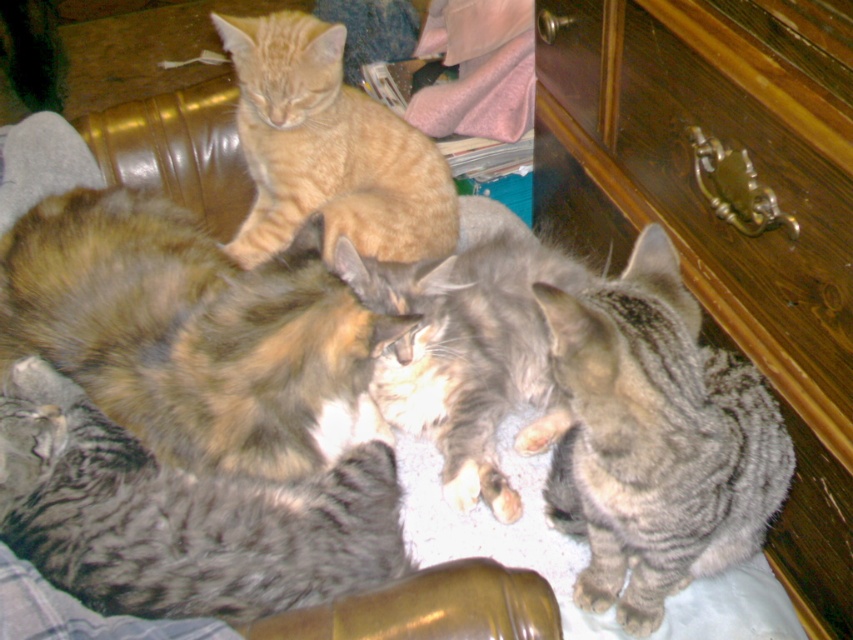
Is point (601, 381) positioned after point (445, 284)?

No, it is not.

Which of these two, gray striped cat at lower right or gray striped cat at center, stands taller?

gray striped cat at lower right is taller.

Measure the distance between point (593, 428) and camera.

Point (593, 428) and camera are 31.24 inches apart from each other.

This screenshot has width=853, height=640. I want to click on gray striped cat at lower right, so click(x=656, y=440).

Does calico fur cat at center have a greater height compared to gray striped cat at center?

Incorrect, calico fur cat at center's height is not larger of gray striped cat at center's.

Does point (79, 193) come farther from viewer compared to point (502, 516)?

Yes, it is.

The height and width of the screenshot is (640, 853). I want to click on calico fur cat at center, so click(189, 332).

Is gray striped cat at lower left further to the viewer compared to gray striped cat at center?

No, gray striped cat at lower left is closer to the viewer.

Is gray striped cat at lower left taller than gray striped cat at center?

No.

I want to click on gray striped cat at lower left, so click(181, 516).